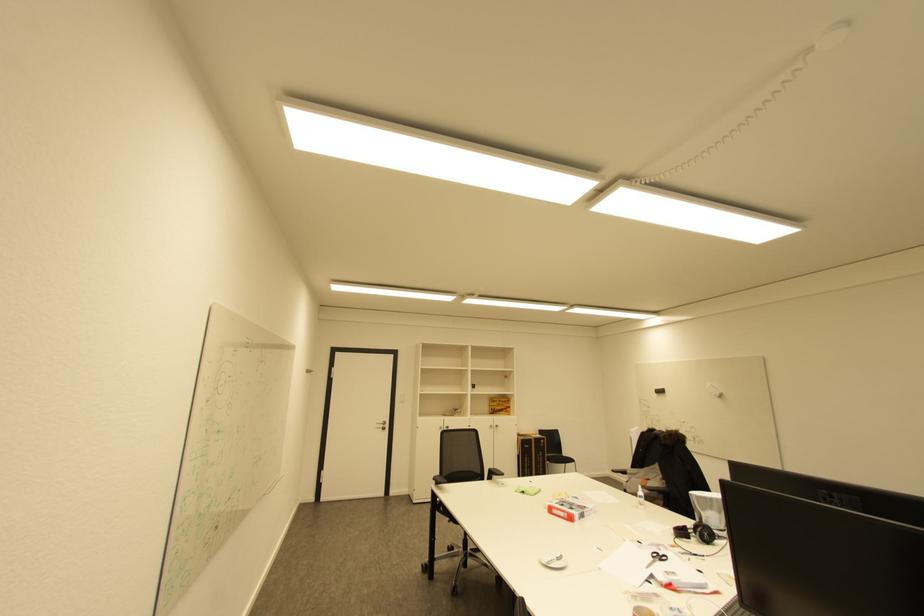
Where would you wear the black headphones? Please return your answer as a coordinate pair (x, y).

(696, 532)